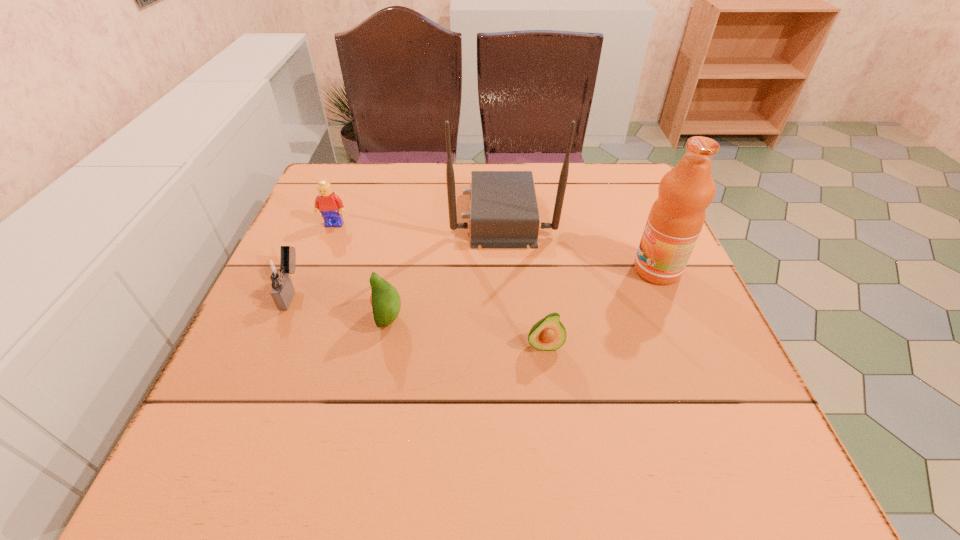
Observe the arrangement of all avocados in the image. To keep them evenly spaced, where would you place another avocado on the right? Please locate a free space. Please provide its 2D coordinates. Your answer should be formatted as a tuple, i.e. [(x, y)], where the tuple contains the x and y coordinates of a point satisfying the conditions above.

[(718, 376)]